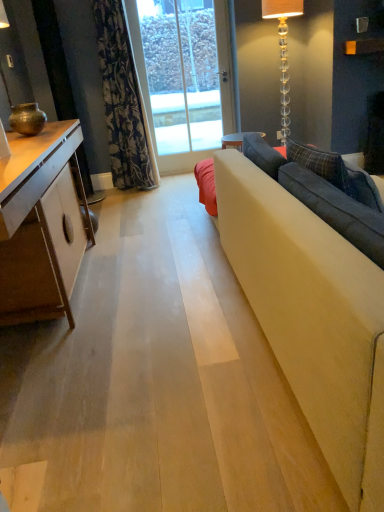
Locate an element on the screen. This screenshot has height=512, width=384. clear glass floor lamp at upper right, placed as the 1th lamp when sorted from back to front is located at coordinates (283, 52).

What is the approximate width of white glossy cabinet at left?

The width of white glossy cabinet at left is 51.32 centimeters.

The width and height of the screenshot is (384, 512). Identify the location of white glossy cabinet at left. (44, 237).

Identify the location of floral fabric curtain at upper left. The image size is (384, 512). (123, 101).

From the image's perspective, does white glossy cabinet at left appear lower than clear glass floor lamp at upper right, the 2th lamp when ordered from left to right?

Yes, from the image's perspective, white glossy cabinet at left is below clear glass floor lamp at upper right, the 2th lamp when ordered from left to right.

Is point (2, 280) in front of point (281, 38)?

Yes, point (2, 280) is closer to viewer.

Locate an element on the screen. This screenshot has width=384, height=512. cabinetry on the left of the clear glass floor lamp at upper right, the first lamp viewed from the right is located at coordinates (44, 237).

In the scene shown: Is white glossy cabinet at left touching clear glass floor lamp at upper right, positioned as the second lamp in front-to-back order?

No, white glossy cabinet at left is not with clear glass floor lamp at upper right, positioned as the second lamp in front-to-back order.

Which is more to the left, matte bronze lamp at left, positioned as the first lamp in front-to-back order, or clear glass door at center?

matte bronze lamp at left, positioned as the first lamp in front-to-back order.

Which is closer, (10, 101) or (219, 41)?

Point (10, 101) is closer to the camera than point (219, 41).

Based on the photo, is matte bronze lamp at left, which appears as the 2th lamp when viewed from the right, spatially inside clear glass door at center, or outside of it?

matte bronze lamp at left, which appears as the 2th lamp when viewed from the right, is not inside clear glass door at center, it's outside.

Can you tell me how much clear glass floor lamp at upper right, the 2th lamp when ordered from left to right, and white glossy cabinet at left differ in facing direction?

The angular difference between clear glass floor lamp at upper right, the 2th lamp when ordered from left to right, and white glossy cabinet at left is 88.8 degrees.

From the picture: Who is bigger, clear glass floor lamp at upper right, the 2th lamp when ordered from left to right, or white glossy cabinet at left?

white glossy cabinet at left.

Considering the relative sizes of clear glass floor lamp at upper right, the first lamp viewed from the right, and white glossy cabinet at left in the image provided, is clear glass floor lamp at upper right, the first lamp viewed from the right, shorter than white glossy cabinet at left?

In fact, clear glass floor lamp at upper right, the first lamp viewed from the right, may be taller than white glossy cabinet at left.

Is clear glass floor lamp at upper right, the first lamp viewed from the right, turned away from white glossy cabinet at left?

No, clear glass floor lamp at upper right, the first lamp viewed from the right, is not facing away from white glossy cabinet at left.

How different are the orientations of clear glass floor lamp at upper right, positioned as the second lamp in front-to-back order, and floral fabric curtain at upper left in degrees?

There is a 0.684-degree angle between the facing directions of clear glass floor lamp at upper right, positioned as the second lamp in front-to-back order, and floral fabric curtain at upper left.

Would you say clear glass floor lamp at upper right, the first lamp viewed from the right, contains floral fabric curtain at upper left?

Actually, floral fabric curtain at upper left is outside clear glass floor lamp at upper right, the first lamp viewed from the right.

Is there a large distance between clear glass floor lamp at upper right, the first lamp viewed from the right, and floral fabric curtain at upper left?

Yes.

Considering their positions, is clear glass floor lamp at upper right, placed as the 1th lamp when sorted from back to front, located in front of or behind floral fabric curtain at upper left?

clear glass floor lamp at upper right, placed as the 1th lamp when sorted from back to front, is behind floral fabric curtain at upper left.

Looking at their sizes, would you say matte bronze lamp at left, arranged as the 2th lamp when viewed from the back, is wider or thinner than floral fabric curtain at upper left?

In the image, matte bronze lamp at left, arranged as the 2th lamp when viewed from the back, appears to be more narrow than floral fabric curtain at upper left.

Between matte bronze lamp at left, which ranks as the 1th lamp in left-to-right order, and floral fabric curtain at upper left, which one is positioned behind?

floral fabric curtain at upper left is further from the camera.

Can you confirm if matte bronze lamp at left, positioned as the first lamp in front-to-back order, is smaller than floral fabric curtain at upper left?

Yes, matte bronze lamp at left, positioned as the first lamp in front-to-back order, is smaller than floral fabric curtain at upper left.

Which is behind, clear glass floor lamp at upper right, placed as the 1th lamp when sorted from back to front, or matte bronze lamp at left, arranged as the 2th lamp when viewed from the back?

clear glass floor lamp at upper right, placed as the 1th lamp when sorted from back to front.

From a real-world perspective, relative to matte bronze lamp at left, arranged as the 2th lamp when viewed from the back, is clear glass floor lamp at upper right, positioned as the second lamp in front-to-back order, vertically above or below?

Clearly, from a real-world perspective, clear glass floor lamp at upper right, positioned as the second lamp in front-to-back order, is below matte bronze lamp at left, arranged as the 2th lamp when viewed from the back.

The height and width of the screenshot is (512, 384). In order to click on lamp positioned vertically above the clear glass floor lamp at upper right, the 2th lamp when ordered from left to right (from a real-world perspective) in this screenshot , I will do `click(13, 66)`.

Considering the relative sizes of clear glass floor lamp at upper right, positioned as the second lamp in front-to-back order, and matte bronze lamp at left, arranged as the 2th lamp when viewed from the back, in the image provided, is clear glass floor lamp at upper right, positioned as the second lamp in front-to-back order, taller than matte bronze lamp at left, arranged as the 2th lamp when viewed from the back,?

Yes, clear glass floor lamp at upper right, positioned as the second lamp in front-to-back order, is taller than matte bronze lamp at left, arranged as the 2th lamp when viewed from the back.

Which object is positioned more to the right, white glossy cabinet at left or clear glass door at center?

From the viewer's perspective, clear glass door at center appears more on the right side.

Considering the points (10, 290) and (226, 109), which point is behind, point (10, 290) or point (226, 109)?

The point (226, 109) is behind.

How many degrees apart are the facing directions of white glossy cabinet at left and clear glass door at center?

They differ by 89.8 degrees in their facing directions.

Based on the photo, from the image's perspective, is white glossy cabinet at left positioned above or below clear glass door at center?

Based on their image positions, white glossy cabinet at left is located beneath clear glass door at center.

The width and height of the screenshot is (384, 512). In order to click on cabinetry that is in front of the clear glass floor lamp at upper right, positioned as the second lamp in front-to-back order in this screenshot , I will do `click(44, 237)`.

The image size is (384, 512). I want to click on window screen below the matte bronze lamp at left, arranged as the 2th lamp when viewed from the back (from a real-world perspective), so click(149, 101).

Which object lies nearer to the anchor point matte bronze lamp at left, which ranks as the 1th lamp in left-to-right order, floral fabric curtain at upper left or clear glass floor lamp at upper right, positioned as the second lamp in front-to-back order?

floral fabric curtain at upper left lies closer to matte bronze lamp at left, which ranks as the 1th lamp in left-to-right order, than the other object.

Estimate the real-world distances between objects in this image. Which object is closer to white glossy cabinet at left, floral fabric curtain at upper left or clear glass door at center?

The object closer to white glossy cabinet at left is floral fabric curtain at upper left.

Based on their spatial positions, is clear glass door at center or floral fabric curtain at upper left closer to white glossy cabinet at left?

floral fabric curtain at upper left is closer to white glossy cabinet at left.

Looking at the image, which one is located closer to clear glass floor lamp at upper right, placed as the 1th lamp when sorted from back to front, clear glass door at center or floral fabric curtain at upper left?

clear glass door at center lies closer to clear glass floor lamp at upper right, placed as the 1th lamp when sorted from back to front, than the other object.

Consider the image. Based on their spatial positions, is floral fabric curtain at upper left or white glossy cabinet at left further from clear glass floor lamp at upper right, positioned as the second lamp in front-to-back order?

Among the two, white glossy cabinet at left is located further to clear glass floor lamp at upper right, positioned as the second lamp in front-to-back order.

Estimate the real-world distances between objects in this image. Which object is further from white glossy cabinet at left, clear glass floor lamp at upper right, positioned as the second lamp in front-to-back order, or matte bronze lamp at left, arranged as the 2th lamp when viewed from the back?

The object further to white glossy cabinet at left is clear glass floor lamp at upper right, positioned as the second lamp in front-to-back order.

Looking at the image, which one is located closer to matte bronze lamp at left, which ranks as the 1th lamp in left-to-right order, clear glass floor lamp at upper right, the first lamp viewed from the right, or white glossy cabinet at left?

white glossy cabinet at left is closer to matte bronze lamp at left, which ranks as the 1th lamp in left-to-right order.

From the image, which object appears to be nearer to floral fabric curtain at upper left, matte bronze lamp at left, positioned as the first lamp in front-to-back order, or white glossy cabinet at left?

matte bronze lamp at left, positioned as the first lamp in front-to-back order, lies closer to floral fabric curtain at upper left than the other object.

Find the location of a particular element. cabinetry located between matte bronze lamp at left, which ranks as the 1th lamp in left-to-right order, and clear glass floor lamp at upper right, the first lamp viewed from the right, in the left-right direction is located at coordinates (44, 237).

This screenshot has height=512, width=384. In order to click on curtain between matte bronze lamp at left, arranged as the 2th lamp when viewed from the back, and clear glass floor lamp at upper right, the 2th lamp when ordered from left to right, from left to right in this screenshot , I will do `click(123, 101)`.

This screenshot has width=384, height=512. In order to click on lamp between white glossy cabinet at left and floral fabric curtain at upper left from front to back in this screenshot , I will do point(13,66).

This screenshot has width=384, height=512. In order to click on curtain between matte bronze lamp at left, positioned as the first lamp in front-to-back order, and clear glass door at center in the front-back direction in this screenshot , I will do `click(123, 101)`.